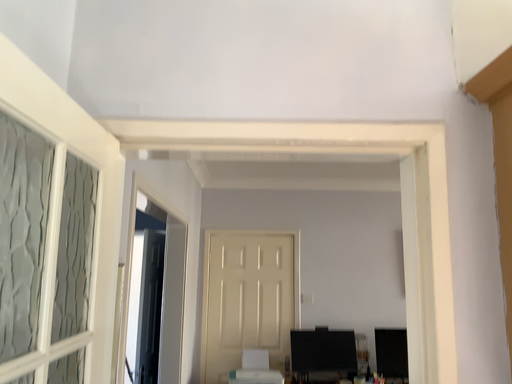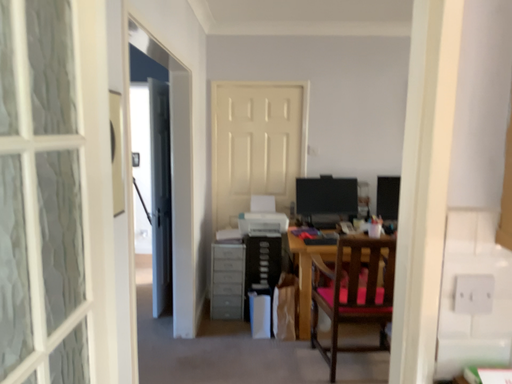
Question: Which way did the camera rotate in the video?

Choices:
 (A) rotated downward
 (B) rotated upward

Answer: (A)